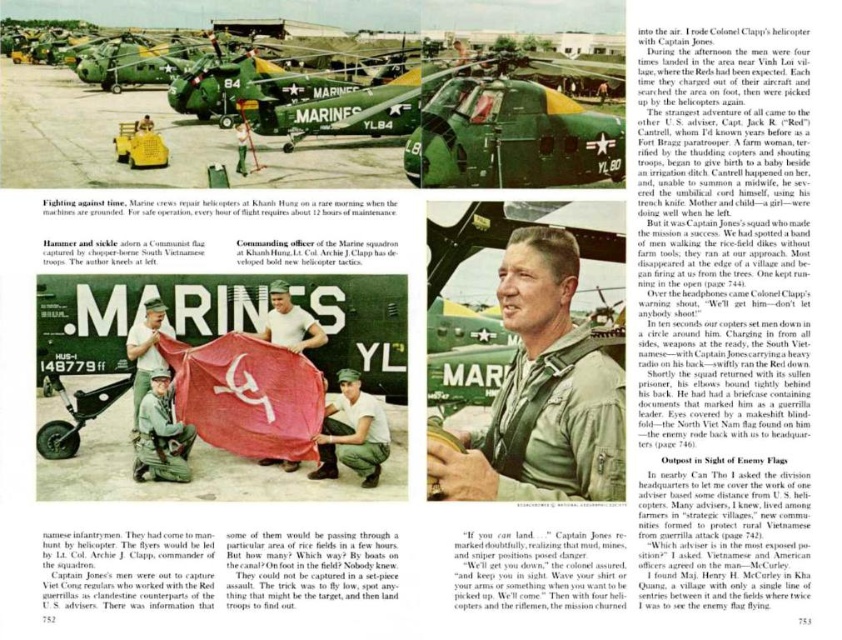
Question: Which point is farther to the camera?

Choices:
 (A) green matte helicopter at center
 (B) camouflage uniform at center
 (C) white cotton shirt at center
 (D) camouflage fabric helmet at center

Answer: (A)

Question: Which of the following is the closest to the observer?

Choices:
 (A) green matte helicopter at center
 (B) white cotton shirt at center
 (C) camouflage uniform at center

Answer: (C)

Question: Is green matte helicopter at center above camouflage uniform at center?

Choices:
 (A) no
 (B) yes

Answer: (B)

Question: Which point is farther to the camera?

Choices:
 (A) camouflage uniform at center
 (B) green military uniform at center
 (C) camouflage fabric helmet at center
 (D) green matte helicopter at center

Answer: (D)

Question: Can you confirm if green military uniform at center is positioned above camouflage fabric helmet at center?

Choices:
 (A) no
 (B) yes

Answer: (B)

Question: Can you confirm if green matte helicopter at center is smaller than camouflage uniform at center?

Choices:
 (A) no
 (B) yes

Answer: (A)